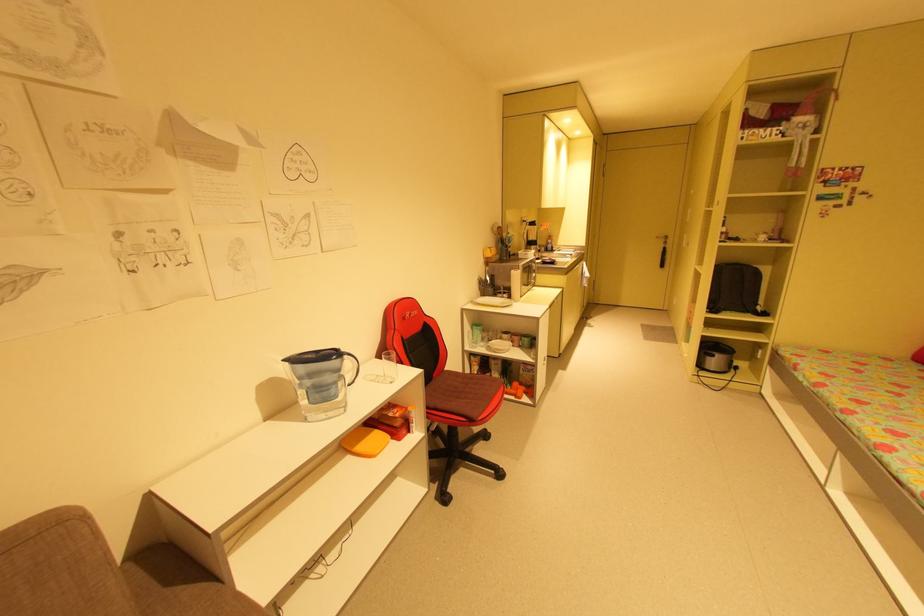
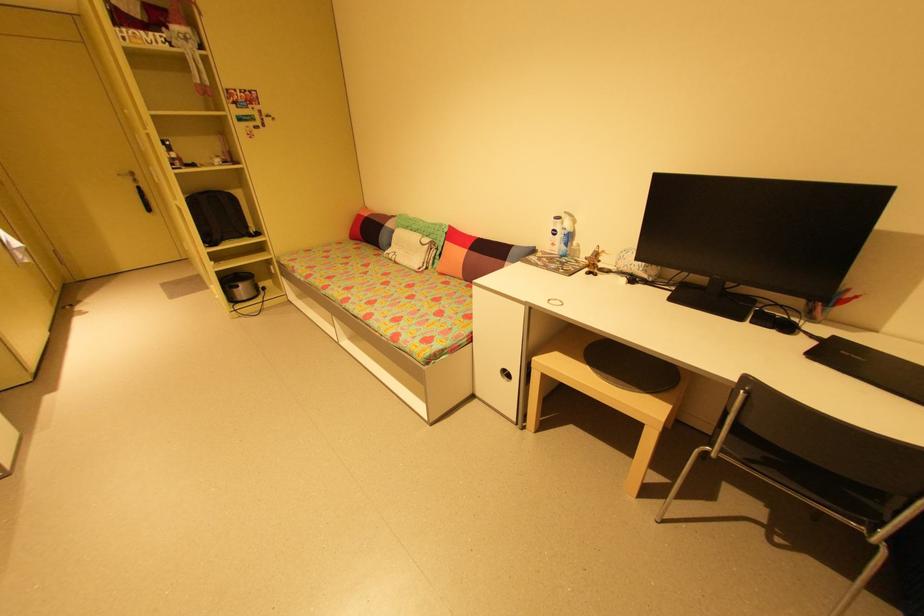
Find the pixel in the second image that matches the point at 712,358 in the first image.

(239, 291)